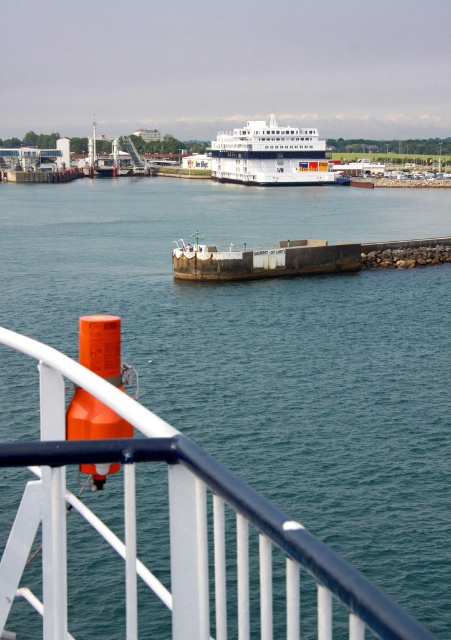
Between white glossy rail at lower left and white glossy cruise ship at center, which one appears on the right side from the viewer's perspective?

From the viewer's perspective, white glossy cruise ship at center appears more on the right side.

Between white glossy rail at lower left and white glossy cruise ship at center, which one is positioned higher?

white glossy cruise ship at center

Image resolution: width=451 pixels, height=640 pixels. Describe the element at coordinates (171, 525) in the screenshot. I see `white glossy rail at lower left` at that location.

Where is `white glossy rail at lower left`? This screenshot has height=640, width=451. white glossy rail at lower left is located at coordinates (171, 525).